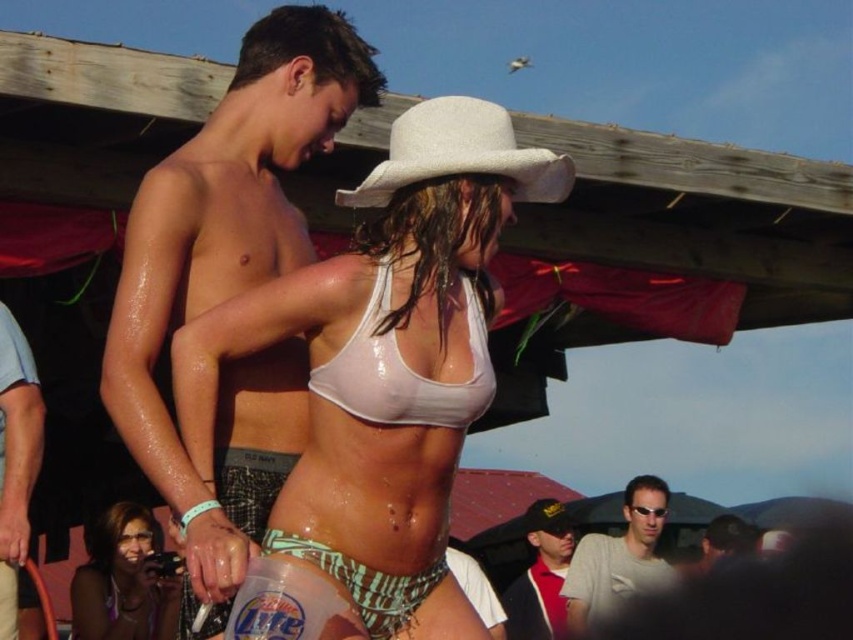
Is matte white camera at center to the left of dark blue baseball cap at lower center from the viewer's perspective?

Indeed, matte white camera at center is positioned on the left side of dark blue baseball cap at lower center.

This screenshot has width=853, height=640. What do you see at coordinates (123, 580) in the screenshot?
I see `matte white camera at center` at bounding box center [123, 580].

The width and height of the screenshot is (853, 640). Identify the location of matte white camera at center. (123, 580).

Does white matte bikini top at center appear under gray fabric sunglasses at center?

No.

Is white matte bikini top at center wider than gray fabric sunglasses at center?

No.

Image resolution: width=853 pixels, height=640 pixels. What do you see at coordinates (403, 369) in the screenshot?
I see `white matte bikini top at center` at bounding box center [403, 369].

Identify the location of white matte bikini top at center. The height and width of the screenshot is (640, 853). (403, 369).

Which of these two, matte white camera at center or black fabric hat at center, stands taller?

With more height is matte white camera at center.

Does point (106, 566) lie behind point (558, 524)?

No, it is not.

I want to click on matte white camera at center, so click(123, 580).